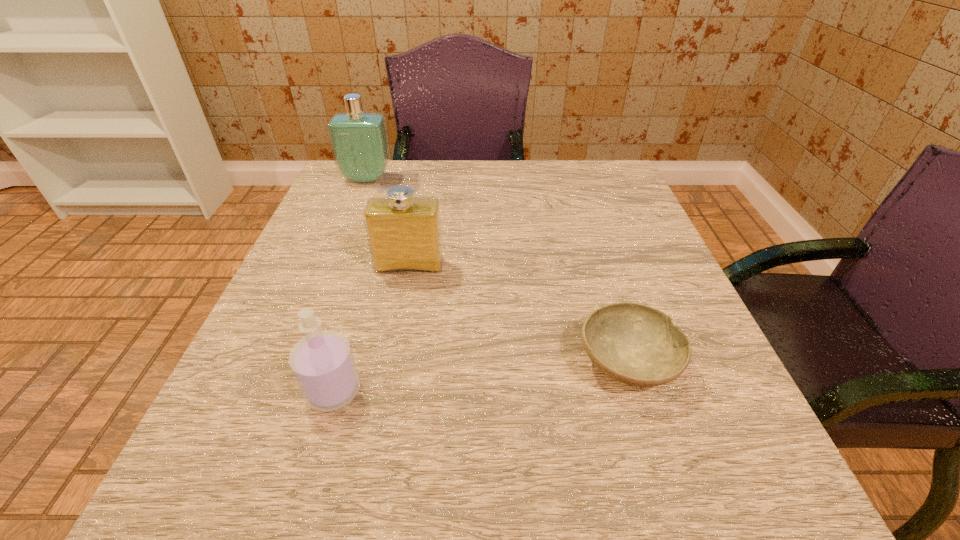
The width and height of the screenshot is (960, 540). I want to click on perfume identified as the closest to the nearest perfume, so point(404,234).

At what (x,y) coordinates should I click in order to perform the action: click on blank area in the image that satisfies the following two spatial constraints: 1. on the front label of the rightmost object; 2. on the left side of the farthest object. Please return your answer as a coordinate pair (x, y). The width and height of the screenshot is (960, 540). Looking at the image, I should click on (294, 362).

Locate an element on the screen. The width and height of the screenshot is (960, 540). vacant space that satisfies the following two spatial constraints: 1. on the front label of the farthest perfume; 2. on the left side of the bowl is located at coordinates (294, 362).

The image size is (960, 540). I want to click on vacant area that satisfies the following two spatial constraints: 1. on the front label of the shortest perfume; 2. on the left side of the farthest object, so click(x=283, y=390).

You are a GUI agent. You are given a task and a screenshot of the screen. Output one action in this format:
    pyautogui.click(x=<x>, y=<y>)
    Task: Click on the vacant space that satisfies the following two spatial constraints: 1. on the front label of the farthest perfume; 2. on the right side of the bowl
    Image resolution: width=960 pixels, height=540 pixels.
    Given the screenshot: What is the action you would take?
    pyautogui.click(x=294, y=362)

This screenshot has width=960, height=540. I want to click on free space that satisfies the following two spatial constraints: 1. on the front label of the farthest object; 2. on the left side of the shortest object, so click(294, 362).

I want to click on free space that satisfies the following two spatial constraints: 1. on the front label of the shortest object; 2. on the left side of the farthest object, so click(294, 362).

Identify the location of vacant space that satisfies the following two spatial constraints: 1. on the front label of the farthest object; 2. on the left side of the shortest object. This screenshot has width=960, height=540. (294, 362).

What are the coordinates of `vacant region that satisfies the following two spatial constraints: 1. on the back side of the second shortest object; 2. on the left side of the rightmost object` in the screenshot? It's located at (342, 362).

Find the location of a particular element. This screenshot has width=960, height=540. vacant point that satisfies the following two spatial constraints: 1. on the front-facing side of the bowl; 2. on the right side of the third nearest object is located at coordinates (392, 362).